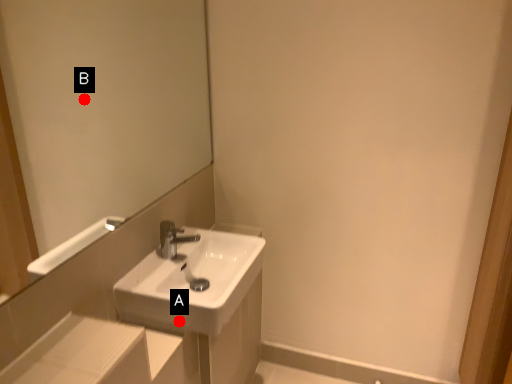
Question: Two points are circled on the image, labeled by A and B beside each circle. Which of the following is the closest to the observer?

Choices:
 (A) A is closer
 (B) B is closer

Answer: (A)